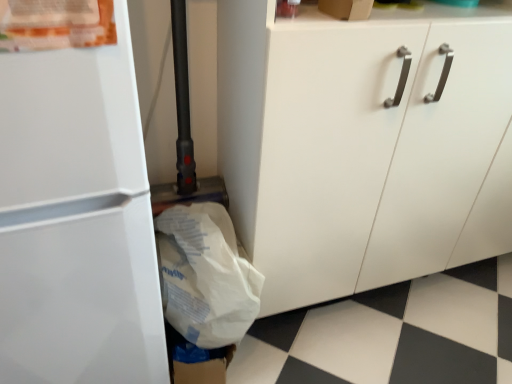
This screenshot has height=384, width=512. Find the location of `white paper grocery bag at lower left`. white paper grocery bag at lower left is located at coordinates (206, 275).

I want to click on white matte cabinet at center, so click(364, 144).

Consider the image. Is white glossy refrigerator at left taller or shorter than white paper grocery bag at lower left?

white glossy refrigerator at left is taller than white paper grocery bag at lower left.

From the image's perspective, would you say white glossy refrigerator at left is positioned over white paper grocery bag at lower left?

Indeed, from the image's perspective, white glossy refrigerator at left is shown above white paper grocery bag at lower left.

Visually, is white glossy refrigerator at left positioned to the left or to the right of white paper grocery bag at lower left?

white glossy refrigerator at left is positioned on white paper grocery bag at lower left's left side.

From a real-world perspective, who is located lower, white matte cabinet at center or white glossy refrigerator at left?

In real-world perspective, white matte cabinet at center is lower.

Is white matte cabinet at center inside the boundaries of white glossy refrigerator at left, or outside?

white matte cabinet at center lies outside white glossy refrigerator at left.

Consider the image. Can you confirm if white matte cabinet at center is positioned to the right of white glossy refrigerator at left?

Yes.

Which of these two, white matte cabinet at center or white paper grocery bag at lower left, is wider?

white matte cabinet at center is wider.

Considering the relative positions of white matte cabinet at center and white paper grocery bag at lower left in the image provided, is white matte cabinet at center behind white paper grocery bag at lower left?

No, it is in front of white paper grocery bag at lower left.

Which of these two, white matte cabinet at center or white paper grocery bag at lower left, stands shorter?

white paper grocery bag at lower left.

Do you think white matte cabinet at center is within white paper grocery bag at lower left, or outside of it?

white matte cabinet at center exists outside the volume of white paper grocery bag at lower left.

From a real-world perspective, is white glossy refrigerator at left over white matte cabinet at center?

Correct, in the physical world, white glossy refrigerator at left is higher than white matte cabinet at center.

Does white glossy refrigerator at left have a greater width compared to white matte cabinet at center?

Indeed, white glossy refrigerator at left has a greater width compared to white matte cabinet at center.

Does white glossy refrigerator at left have a greater height compared to white matte cabinet at center?

Correct, white glossy refrigerator at left is much taller as white matte cabinet at center.

From a real-world perspective, relative to white glossy refrigerator at left, is white paper grocery bag at lower left vertically above or below?

Clearly, from a real-world perspective, white paper grocery bag at lower left is below white glossy refrigerator at left.

Who is taller, white paper grocery bag at lower left or white glossy refrigerator at left?

With more height is white glossy refrigerator at left.

What's the angular difference between white paper grocery bag at lower left and white glossy refrigerator at left's facing directions?

4.3 degrees.

Locate an element on the screen. The image size is (512, 384). grocery bag behind the white glossy refrigerator at left is located at coordinates (206, 275).

Between white paper grocery bag at lower left and white matte cabinet at center, which one is positioned behind?

white paper grocery bag at lower left is behind.

Which point is more distant from viewer, (x=170, y=242) or (x=354, y=204)?

The point (x=170, y=242) is farther.

From the image's perspective, is white paper grocery bag at lower left above white matte cabinet at center?

No.

What's the angular difference between white paper grocery bag at lower left and white matte cabinet at center's facing directions?

4.31 degrees separate the facing orientations of white paper grocery bag at lower left and white matte cabinet at center.

At what (x,y) coordinates should I click in order to perform the action: click on grocery bag below the white glossy refrigerator at left (from a real-world perspective). Please return your answer as a coordinate pair (x, y). Looking at the image, I should click on (206, 275).

In the image, there is a white glossy refrigerator at left. At what (x,y) coordinates should I click in order to perform the action: click on cabinetry above it (from the image's perspective). Please return your answer as a coordinate pair (x, y). The image size is (512, 384). Looking at the image, I should click on (364, 144).

From the image, which object appears to be farther from white glossy refrigerator at left, white matte cabinet at center or white paper grocery bag at lower left?

white matte cabinet at center.

Considering their positions, is white matte cabinet at center positioned further to white paper grocery bag at lower left than white glossy refrigerator at left?

white matte cabinet at center is further to white paper grocery bag at lower left.

Which object lies nearer to the anchor point white paper grocery bag at lower left, white glossy refrigerator at left or white matte cabinet at center?

white glossy refrigerator at left is closer to white paper grocery bag at lower left.

Consider the image. Looking at the image, which one is located closer to white matte cabinet at center, white paper grocery bag at lower left or white glossy refrigerator at left?

white paper grocery bag at lower left is positioned closer to the anchor white matte cabinet at center.

Considering their positions, is white glossy refrigerator at left positioned closer to white matte cabinet at center than white paper grocery bag at lower left?

white paper grocery bag at lower left lies closer to white matte cabinet at center than the other object.

From the image, which object appears to be nearer to white glossy refrigerator at left, white paper grocery bag at lower left or white matte cabinet at center?

white paper grocery bag at lower left is closer to white glossy refrigerator at left.

Where is `grocery bag between white glossy refrigerator at left and white matte cabinet at center in the horizontal direction`? The image size is (512, 384). grocery bag between white glossy refrigerator at left and white matte cabinet at center in the horizontal direction is located at coordinates (206, 275).